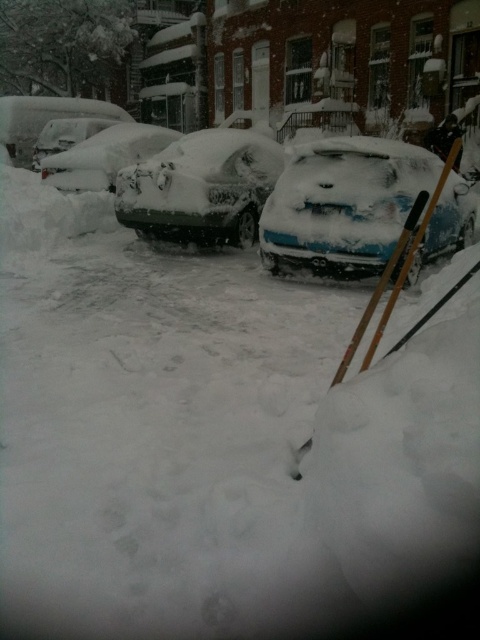
Question: Which is nearer to the white matte car at left?

Choices:
 (A) snow-covered car at center
 (B) snow-covered sedan at center
 (C) blue matte car at center

Answer: (B)

Question: Observing the image, what is the correct spatial positioning of snow-covered sedan at center in reference to white matte car at left?

Choices:
 (A) right
 (B) left

Answer: (A)

Question: Does snow-covered car at center have a lesser width compared to snow-covered sedan at center?

Choices:
 (A) yes
 (B) no

Answer: (B)

Question: Which point appears farthest from the camera in this image?

Choices:
 (A) (454, 227)
 (B) (96, 138)
 (C) (88, 122)

Answer: (C)

Question: Considering the real-world distances, which object is closest to the white matte car at left?

Choices:
 (A) snow-covered car at center
 (B) blue matte car at center

Answer: (A)

Question: Does snow-covered car at center have a larger size compared to white matte car at left?

Choices:
 (A) yes
 (B) no

Answer: (A)